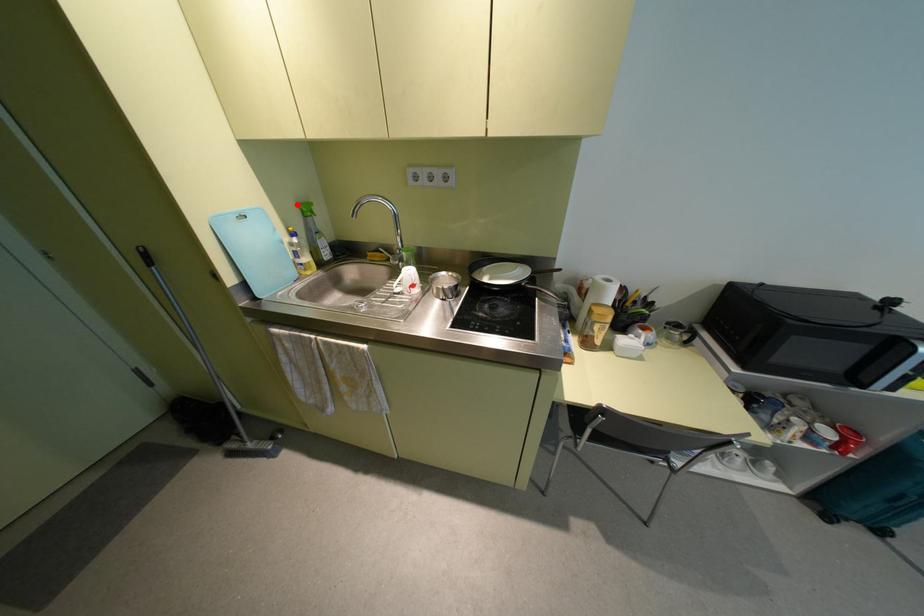
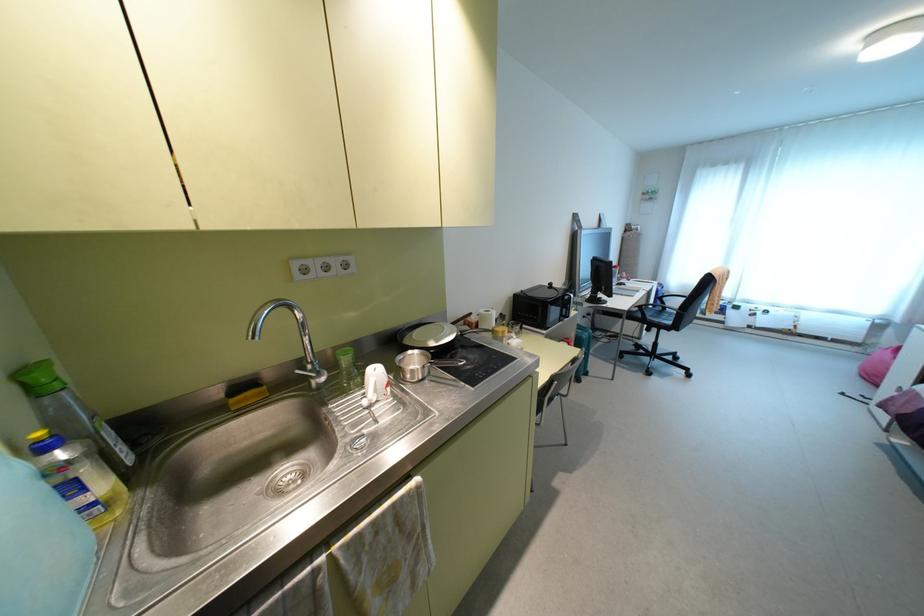
Locate, in the second image, the point that corresponds to the highlighted location in the first image.

(20, 374)